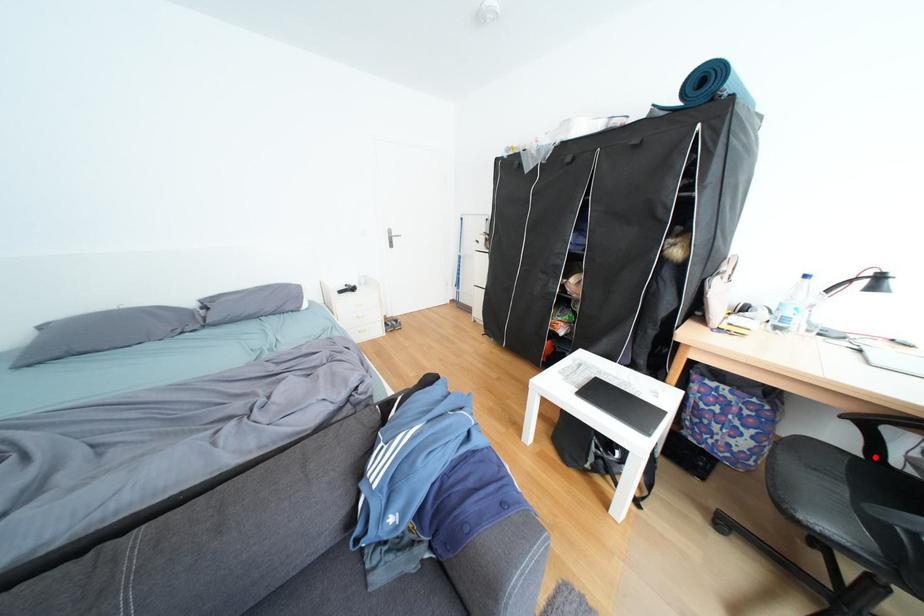
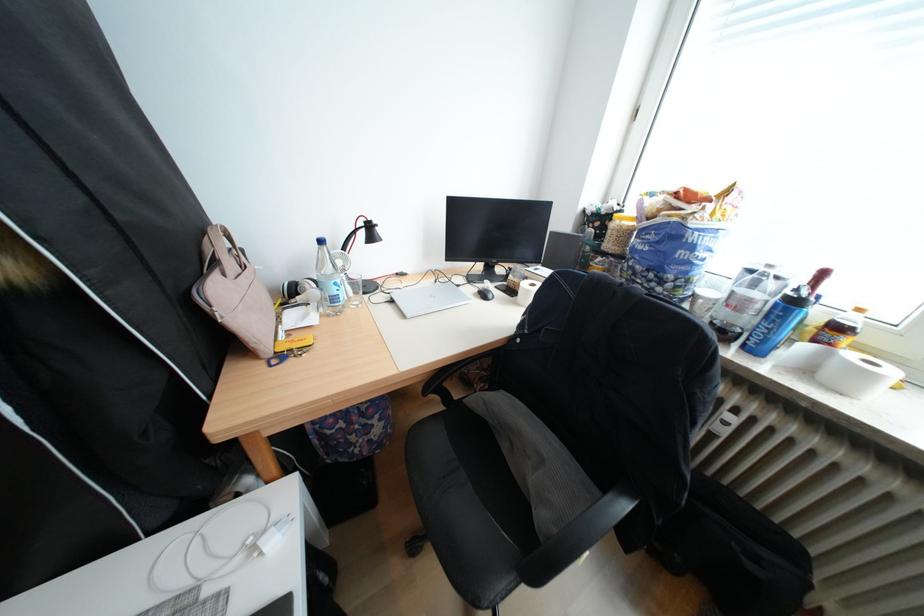
In the second image, find the point that corresponds to the highlighted location in the first image.

(456, 408)